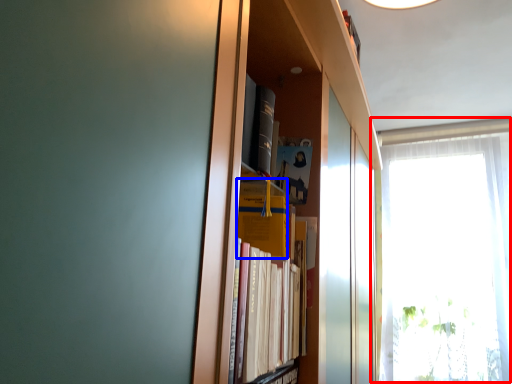
Question: Among these objects, which one is nearest to the camera, window (highlighted by a red box) or paperback book (highlighted by a blue box)?

Choices:
 (A) window
 (B) paperback book

Answer: (B)